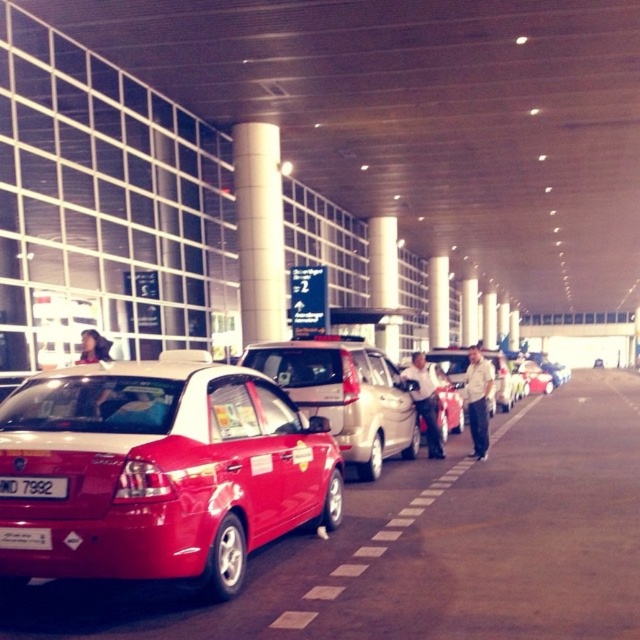
This screenshot has width=640, height=640. What do you see at coordinates (161, 470) in the screenshot? I see `shiny red sedan at center` at bounding box center [161, 470].

Does shiny red sedan at center appear on the left side of white plastic license plate at center?

In fact, shiny red sedan at center is to the right of white plastic license plate at center.

Between point (266, 442) and point (26, 538), which one is positioned in front?

Point (26, 538) is in front.

This screenshot has height=640, width=640. In order to click on shiny red sedan at center in this screenshot , I will do `click(161, 470)`.

Can you confirm if metallic silver suv at center is thinner than black plastic license plate at lower left?

Indeed, metallic silver suv at center has a lesser width compared to black plastic license plate at lower left.

Does point (394, 397) come in front of point (4, 484)?

No, it is behind (4, 484).

Locate an element on the screen. Image resolution: width=640 pixels, height=640 pixels. metallic silver suv at center is located at coordinates (344, 394).

Which of these two, shiny red sedan at center or black plastic license plate at lower left, stands taller?

shiny red sedan at center is taller.

In the scene shown: Is shiny red sedan at center bigger than black plastic license plate at lower left?

Correct, shiny red sedan at center is larger in size than black plastic license plate at lower left.

The height and width of the screenshot is (640, 640). Describe the element at coordinates (161, 470) in the screenshot. I see `shiny red sedan at center` at that location.

Image resolution: width=640 pixels, height=640 pixels. I want to click on shiny red sedan at center, so click(161, 470).